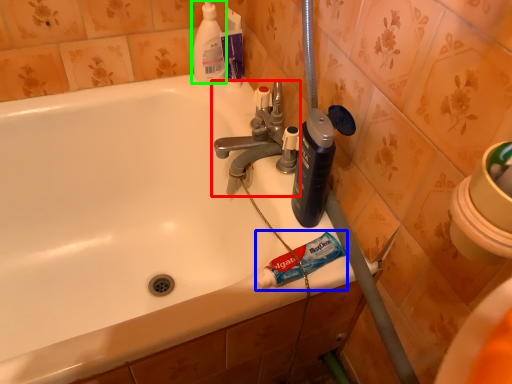
Question: Considering the real-world distances, which object is farthest from tap (highlighted by a red box)? toothpaste (highlighted by a blue box) or cleaning product (highlighted by a green box)?

Choices:
 (A) toothpaste
 (B) cleaning product

Answer: (A)